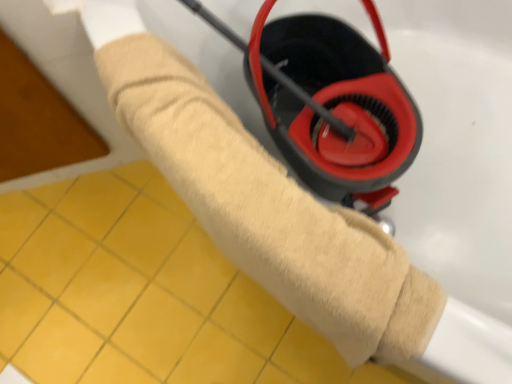
Question: Is beige plush towel at center not near yellow tile at lower left?

Choices:
 (A) no
 (B) yes

Answer: (A)

Question: Is beige plush towel at center shorter than yellow tile at lower left?

Choices:
 (A) yes
 (B) no

Answer: (B)

Question: Is beige plush towel at center at the right side of yellow tile at lower left?

Choices:
 (A) yes
 (B) no

Answer: (A)

Question: Is beige plush towel at center oriented away from yellow tile at lower left?

Choices:
 (A) no
 (B) yes

Answer: (A)

Question: Does beige plush towel at center come in front of yellow tile at lower left?

Choices:
 (A) no
 (B) yes

Answer: (B)

Question: Considering the relative sizes of beige plush towel at center and yellow tile at lower left in the image provided, is beige plush towel at center wider than yellow tile at lower left?

Choices:
 (A) yes
 (B) no

Answer: (A)

Question: From a real-world perspective, does yellow tile at lower left stand above beige plush towel at center?

Choices:
 (A) yes
 (B) no

Answer: (B)

Question: Would you consider yellow tile at lower left to be distant from beige plush towel at center?

Choices:
 (A) yes
 (B) no

Answer: (B)

Question: Considering the relative sizes of yellow tile at lower left and beige plush towel at center in the image provided, is yellow tile at lower left taller than beige plush towel at center?

Choices:
 (A) yes
 (B) no

Answer: (B)

Question: Is yellow tile at lower left turned away from beige plush towel at center?

Choices:
 (A) yes
 (B) no

Answer: (B)

Question: From the image's perspective, is yellow tile at lower left on top of beige plush towel at center?

Choices:
 (A) yes
 (B) no

Answer: (B)

Question: Does yellow tile at lower left have a smaller size compared to beige plush towel at center?

Choices:
 (A) yes
 (B) no

Answer: (A)

Question: From a real-world perspective, is beige plush towel at center above or below yellow tile at lower left?

Choices:
 (A) above
 (B) below

Answer: (A)